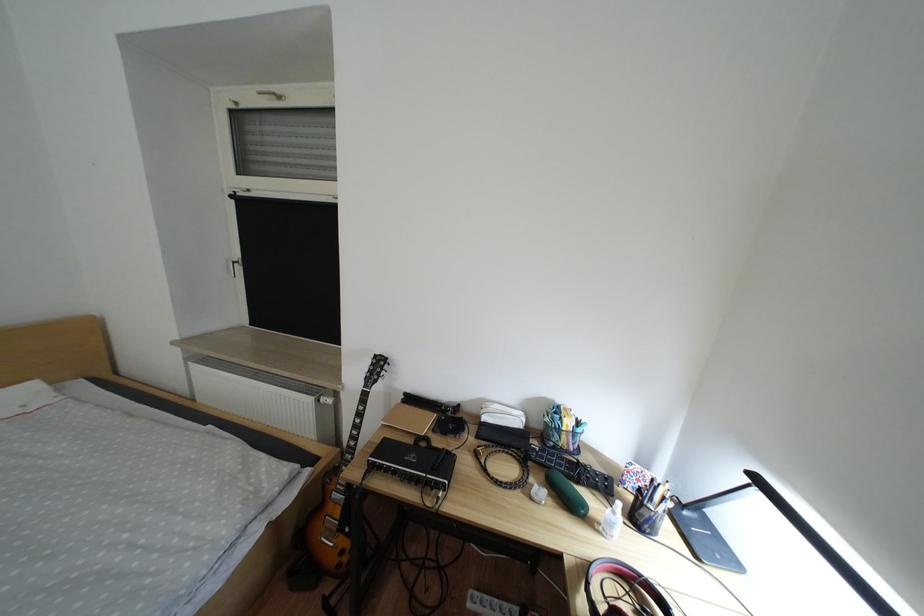
Locate an element on the screen. white computer mouse is located at coordinates (502, 415).